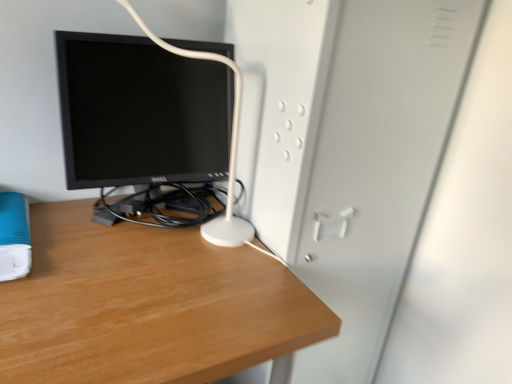
Question: Would you say white matte file cabinet at center is part of blue matte paperback book at lower left's contents?

Choices:
 (A) yes
 (B) no

Answer: (B)

Question: Does blue matte paperback book at lower left touch white matte file cabinet at center?

Choices:
 (A) yes
 (B) no

Answer: (B)

Question: Is blue matte paperback book at lower left closer to camera compared to white matte file cabinet at center?

Choices:
 (A) yes
 (B) no

Answer: (A)

Question: From the image's perspective, is blue matte paperback book at lower left above white matte file cabinet at center?

Choices:
 (A) yes
 (B) no

Answer: (A)

Question: From a real-world perspective, is blue matte paperback book at lower left below white matte file cabinet at center?

Choices:
 (A) yes
 (B) no

Answer: (B)

Question: Considering the relative sizes of blue matte paperback book at lower left and white matte file cabinet at center in the image provided, is blue matte paperback book at lower left smaller than white matte file cabinet at center?

Choices:
 (A) no
 (B) yes

Answer: (B)

Question: Is wooden desk at center behind white matte file cabinet at center?

Choices:
 (A) no
 (B) yes

Answer: (A)

Question: Is wooden desk at center not within white matte file cabinet at center?

Choices:
 (A) no
 (B) yes

Answer: (B)

Question: Is wooden desk at center beside white matte file cabinet at center?

Choices:
 (A) no
 (B) yes

Answer: (A)

Question: Can you confirm if wooden desk at center is smaller than white matte file cabinet at center?

Choices:
 (A) no
 (B) yes

Answer: (A)

Question: Is wooden desk at center positioned with its back to white matte file cabinet at center?

Choices:
 (A) yes
 (B) no

Answer: (B)

Question: Is wooden desk at center bigger than white matte file cabinet at center?

Choices:
 (A) no
 (B) yes

Answer: (B)

Question: Is white matte file cabinet at center wider than blue matte paperback book at lower left?

Choices:
 (A) yes
 (B) no

Answer: (A)